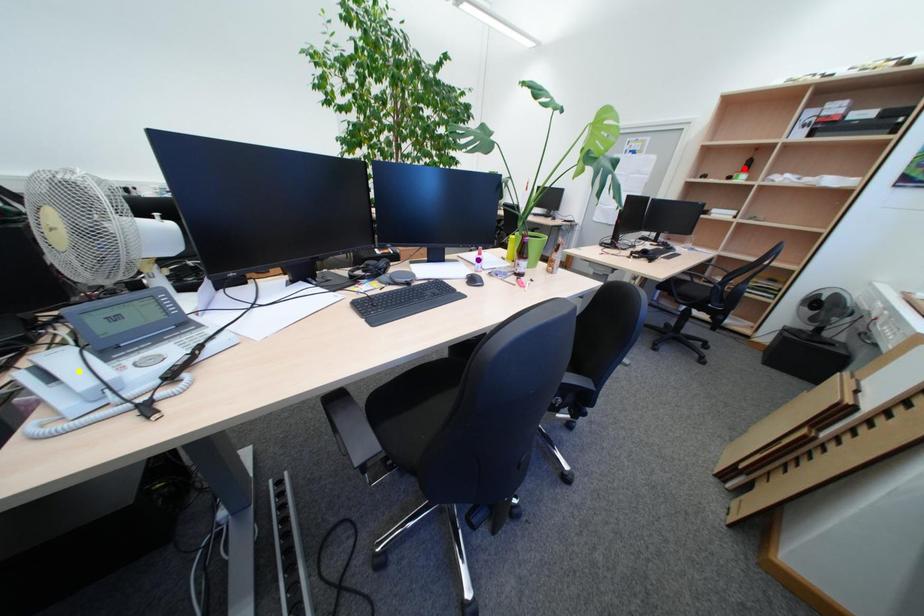
Order these from farthest to nearest:
yellow point, red point, purple point

1. red point
2. purple point
3. yellow point